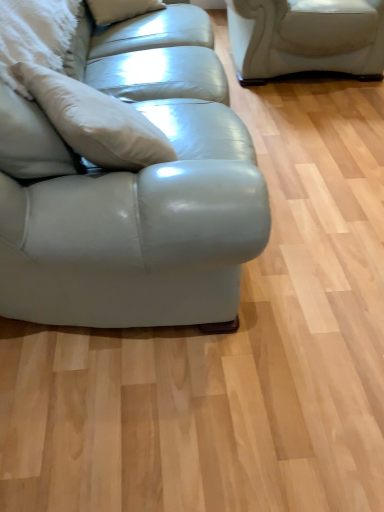
Question: Should I look upward or downward to see white fluffy pillow at left?

Choices:
 (A) down
 (B) up

Answer: (B)

Question: From the image's perspective, is white fluffy pillow at left located above satin beige couch at left?

Choices:
 (A) no
 (B) yes

Answer: (B)

Question: Considering the relative sizes of white fluffy pillow at left and satin beige couch at left in the image provided, is white fluffy pillow at left smaller than satin beige couch at left?

Choices:
 (A) no
 (B) yes

Answer: (A)

Question: Does white fluffy pillow at left have a larger size compared to satin beige couch at left?

Choices:
 (A) yes
 (B) no

Answer: (A)

Question: From a real-world perspective, is white fluffy pillow at left positioned under satin beige couch at left based on gravity?

Choices:
 (A) no
 (B) yes

Answer: (A)

Question: Is white fluffy pillow at left positioned with its back to satin beige couch at left?

Choices:
 (A) no
 (B) yes

Answer: (A)

Question: Does white fluffy pillow at left come in front of satin beige couch at left?

Choices:
 (A) yes
 (B) no

Answer: (B)

Question: Does satin beige couch at left have a larger size compared to white fluffy pillow at left?

Choices:
 (A) yes
 (B) no

Answer: (B)

Question: Considering the relative positions of satin beige couch at left and white fluffy pillow at left in the image provided, is satin beige couch at left behind white fluffy pillow at left?

Choices:
 (A) no
 (B) yes

Answer: (A)

Question: Can you confirm if satin beige couch at left is shorter than white fluffy pillow at left?

Choices:
 (A) yes
 (B) no

Answer: (B)

Question: Is satin beige couch at left thinner than white fluffy pillow at left?

Choices:
 (A) no
 (B) yes

Answer: (A)

Question: Can you confirm if satin beige couch at left is positioned to the right of white fluffy pillow at left?

Choices:
 (A) yes
 (B) no

Answer: (A)

Question: From a real-world perspective, does satin beige couch at left stand above white fluffy pillow at left?

Choices:
 (A) no
 (B) yes

Answer: (A)

Question: Is satin beige couch at left bigger or smaller than white fluffy pillow at left?

Choices:
 (A) small
 (B) big

Answer: (A)